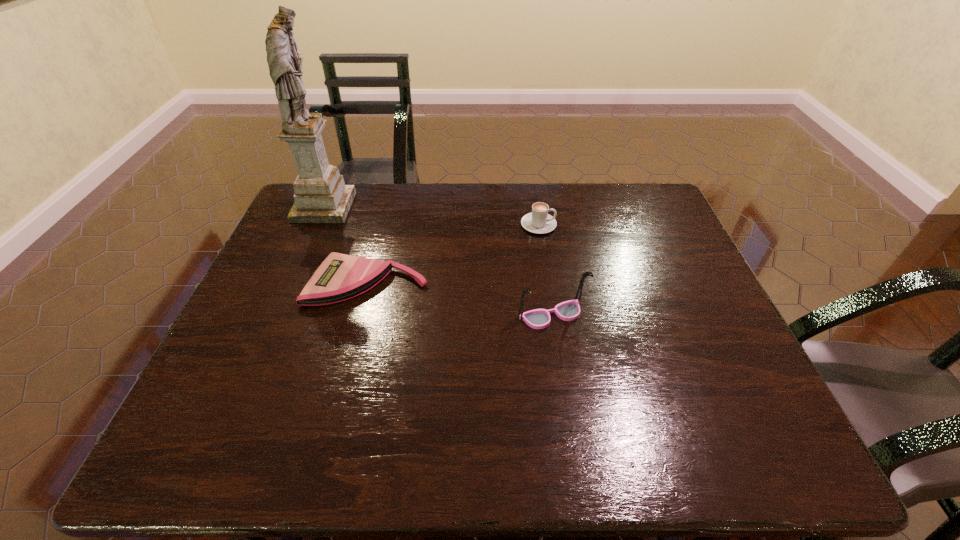
I want to click on free location that satisfies the following two spatial constraints: 1. on the front-facing side of the spectacles; 2. on the right side of the tallest object, so click(x=277, y=315).

Where is `vacant area in the image that satisfies the following two spatial constraints: 1. on the front-facing side of the sculpture; 2. on the left side of the spectacles`? Image resolution: width=960 pixels, height=540 pixels. vacant area in the image that satisfies the following two spatial constraints: 1. on the front-facing side of the sculpture; 2. on the left side of the spectacles is located at coordinates (277, 315).

Where is `free location that satisfies the following two spatial constraints: 1. on the front-facing side of the shortest object; 2. on the left side of the sculpture`? free location that satisfies the following two spatial constraints: 1. on the front-facing side of the shortest object; 2. on the left side of the sculpture is located at coordinates (291, 282).

Identify the location of free spot that satisfies the following two spatial constraints: 1. on the front-facing side of the wristlet; 2. on the right side of the sculpture. This screenshot has width=960, height=540. (291, 282).

Locate an element on the screen. free spot that satisfies the following two spatial constraints: 1. on the front-facing side of the second tallest object; 2. on the right side of the tallest object is located at coordinates (277, 315).